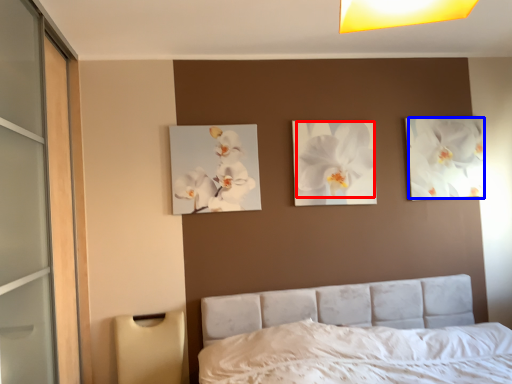
Question: Among these objects, which one is nearest to the camera, flower (highlighted by a red box) or flower (highlighted by a blue box)?

Choices:
 (A) flower
 (B) flower

Answer: (A)